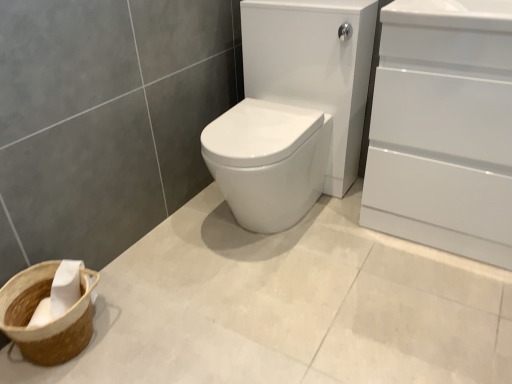
Where is `white glossy sink at center`? The height and width of the screenshot is (384, 512). white glossy sink at center is located at coordinates (293, 110).

From the image's perspective, is white glossy sink at center below brown woven basket at lower left?

Incorrect, from the image's perspective, white glossy sink at center is higher than brown woven basket at lower left.

Is white glossy sink at center not within brown woven basket at lower left?

Yes.

Find the location of `basket container below the white glossy sink at center (from the image's perspective)`. basket container below the white glossy sink at center (from the image's perspective) is located at coordinates (48, 323).

Is brown woven basket at lower left positioned far away from white glossy sink at center?

No, brown woven basket at lower left is not far from white glossy sink at center.

Find the location of a particular element. The height and width of the screenshot is (384, 512). basket container below the white glossy sink at center (from the image's perspective) is located at coordinates (48, 323).

From a real-world perspective, which is physically below, brown woven basket at lower left or white glossy sink at center?

brown woven basket at lower left.

Is brown woven basket at lower left at the left side of white glossy cabinet at right?

Yes.

From the image's perspective, which object appears higher, brown woven basket at lower left or white glossy cabinet at right?

white glossy cabinet at right.

Considering the sizes of objects brown woven basket at lower left and white glossy cabinet at right in the image provided, who is taller, brown woven basket at lower left or white glossy cabinet at right?

white glossy cabinet at right.

From a real-world perspective, who is located lower, brown woven basket at lower left or white glossy cabinet at right?

brown woven basket at lower left, from a real-world perspective.

From a real-world perspective, which is physically below, white glossy cabinet at right or brown woven basket at lower left?

In real-world perspective, brown woven basket at lower left is lower.

From the picture: Is white glossy cabinet at right thinner than brown woven basket at lower left?

No, white glossy cabinet at right is not thinner than brown woven basket at lower left.

Considering the positions of objects white glossy cabinet at right and brown woven basket at lower left in the image provided, who is behind, white glossy cabinet at right or brown woven basket at lower left?

brown woven basket at lower left is more distant.

Is white glossy cabinet at right aimed at white glossy sink at center?

No, white glossy cabinet at right is not oriented towards white glossy sink at center.

Consider the image. Looking at their sizes, would you say white glossy cabinet at right is wider or thinner than white glossy sink at center?

Clearly, white glossy cabinet at right has less width compared to white glossy sink at center.

Which of these two, white glossy cabinet at right or white glossy sink at center, is bigger?

white glossy sink at center is bigger.

Which object is positioned more to the right, white glossy cabinet at right or white glossy sink at center?

Positioned to the right is white glossy cabinet at right.

Considering the relative sizes of white glossy sink at center and white glossy cabinet at right in the image provided, is white glossy sink at center bigger than white glossy cabinet at right?

Correct, white glossy sink at center is larger in size than white glossy cabinet at right.

Would you say white glossy cabinet at right is part of white glossy sink at center's contents?

No, white glossy cabinet at right is not a part of white glossy sink at center.

Is white glossy sink at center oriented away from white glossy cabinet at right?

That's not correct — white glossy sink at center is not looking away from white glossy cabinet at right.

Which is in front, point (270, 183) or point (454, 106)?

The point (454, 106) is more forward.

Identify the location of sink above the brown woven basket at lower left (from the image's perspective). The height and width of the screenshot is (384, 512). (293, 110).

At what (x,y) coordinates should I click in order to perform the action: click on basket container to the left of white glossy sink at center. Please return your answer as a coordinate pair (x, y). The height and width of the screenshot is (384, 512). Looking at the image, I should click on (48, 323).

Looking at the image, which one is located further to white glossy sink at center, brown woven basket at lower left or white glossy cabinet at right?

brown woven basket at lower left is positioned further to the anchor white glossy sink at center.

From the image, which object appears to be nearer to white glossy cabinet at right, white glossy sink at center or brown woven basket at lower left?

white glossy sink at center lies closer to white glossy cabinet at right than the other object.

From the image, which object appears to be nearer to white glossy sink at center, white glossy cabinet at right or brown woven basket at lower left?

white glossy cabinet at right is positioned closer to the anchor white glossy sink at center.

Which object lies nearer to the anchor point white glossy cabinet at right, brown woven basket at lower left or white glossy sink at center?

white glossy sink at center.

Estimate the real-world distances between objects in this image. Which object is further from brown woven basket at lower left, white glossy sink at center or white glossy cabinet at right?

white glossy cabinet at right is positioned further to the anchor brown woven basket at lower left.

Considering their positions, is white glossy cabinet at right positioned closer to brown woven basket at lower left than white glossy sink at center?

white glossy sink at center is positioned closer to the anchor brown woven basket at lower left.

Identify the location of sink situated between brown woven basket at lower left and white glossy cabinet at right from left to right. The width and height of the screenshot is (512, 384). (293, 110).